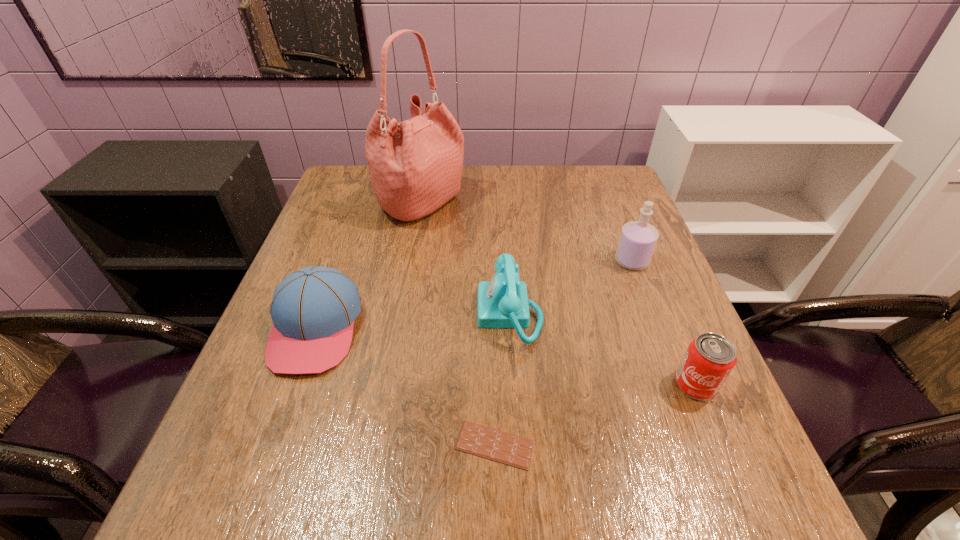
Image resolution: width=960 pixels, height=540 pixels. I want to click on free space that satisfies the following two spatial constraints: 1. on the dial of the telephone; 2. on the front-facing side of the baseball cap, so click(511, 328).

The height and width of the screenshot is (540, 960). In order to click on free space in the image that satisfies the following two spatial constraints: 1. on the front side of the can; 2. on the left side of the handbag in this screenshot , I will do [x=391, y=384].

Where is `free space that satisfies the following two spatial constraints: 1. on the dial of the telephone; 2. on the front side of the chocolate bar`? This screenshot has width=960, height=540. free space that satisfies the following two spatial constraints: 1. on the dial of the telephone; 2. on the front side of the chocolate bar is located at coordinates (518, 445).